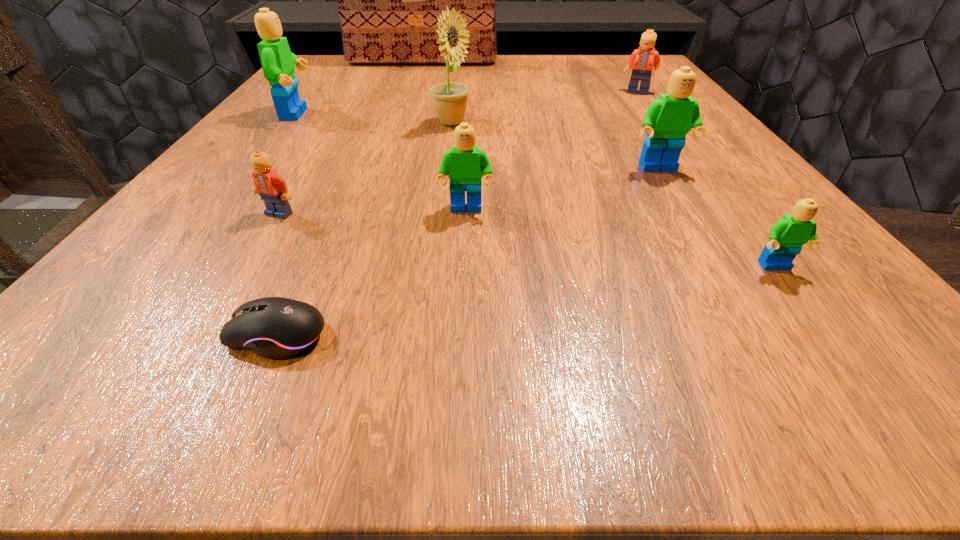
Find the location of `free space between the smaller orange Lego and the third Lego from left to right`. free space between the smaller orange Lego and the third Lego from left to right is located at coordinates (372, 212).

Locate an element on the screen. Image resolution: width=960 pixels, height=540 pixels. free space between the second green Lego from left to right and the fifth nearest object is located at coordinates (563, 189).

The width and height of the screenshot is (960, 540). I want to click on free point between the second tallest Lego and the third Lego from left to right, so click(x=563, y=189).

At what (x,y) coordinates should I click in order to perform the action: click on vacant space in between the fifth farthest object and the third green Lego from right to left. Please return your answer as a coordinate pair (x, y). Image resolution: width=960 pixels, height=540 pixels. Looking at the image, I should click on (563, 189).

Find the location of a particular element. Image resolution: width=960 pixels, height=540 pixels. free space between the farther orange Lego and the yellow sunflower is located at coordinates (544, 107).

Where is `unoccupied area between the yellow sunflower and the right orange Lego`? This screenshot has width=960, height=540. unoccupied area between the yellow sunflower and the right orange Lego is located at coordinates (544, 107).

You are a GUI agent. You are given a task and a screenshot of the screen. Output one action in this format:
    pyautogui.click(x=<x>, y=<y>)
    Task: Click on the object that can be found as the sixth closest to the smallest green Lego
    Image resolution: width=960 pixels, height=540 pixels.
    Given the screenshot: What is the action you would take?
    pos(272,189)

Locate an element on the screen. The height and width of the screenshot is (540, 960). the second closest object relative to the black computer mouse is located at coordinates (466, 165).

This screenshot has width=960, height=540. Find the location of `Lego that is the second closest to the tallest object`. Lego that is the second closest to the tallest object is located at coordinates (646, 58).

Identify which Lego is the third nearest to the black computer mouse. Please provide its 2D coordinates. Your answer should be formatted as a tuple, i.e. [(x, y)], where the tuple contains the x and y coordinates of a point satisfying the conditions above.

[(787, 236)]